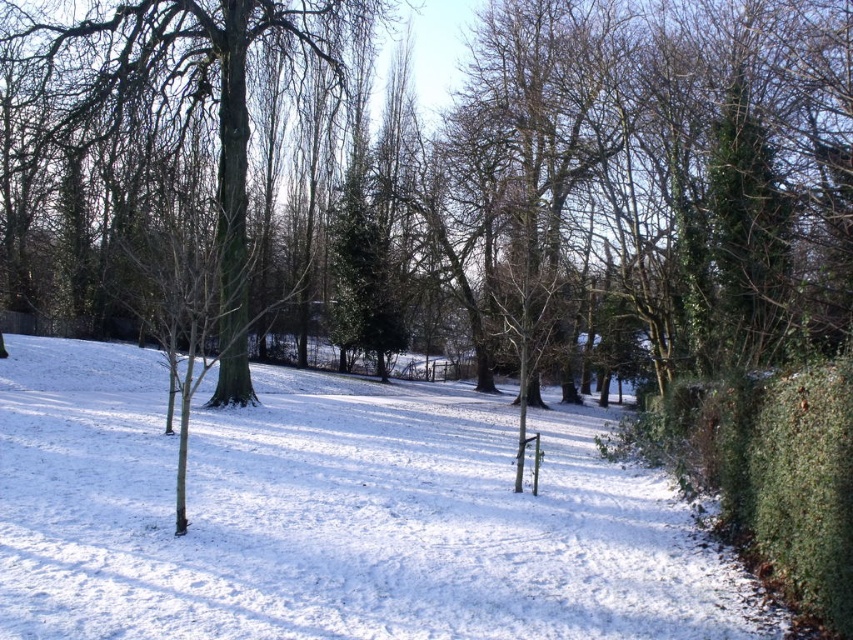
Question: Which point is farther from the camera taking this photo?

Choices:
 (A) (115, 346)
 (B) (247, 6)

Answer: (A)

Question: Is white powdery snow at center bigger than green leafy hedge at right?

Choices:
 (A) yes
 (B) no

Answer: (A)

Question: Which point is farther from the camera taking this photo?

Choices:
 (A) (183, 38)
 (B) (323, 605)
 (C) (686, 456)

Answer: (A)

Question: Does white powdery snow at center appear on the left side of green matte tree at center?

Choices:
 (A) no
 (B) yes

Answer: (A)

Question: Which of the following is the farthest from the observer?

Choices:
 (A) (769, 518)
 (B) (283, 8)

Answer: (B)

Question: Does white powdery snow at center appear under green matte tree at center?

Choices:
 (A) no
 (B) yes

Answer: (B)